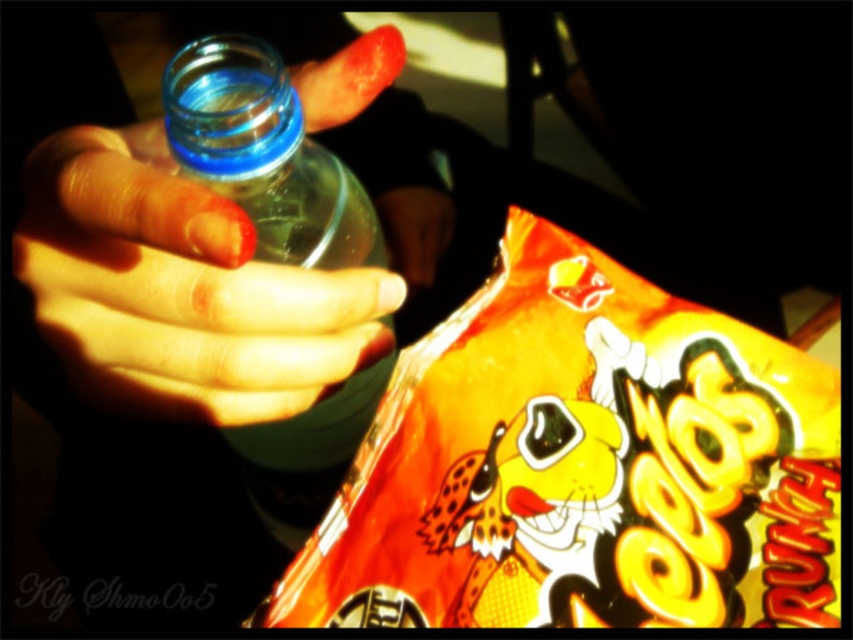
Is point (824, 477) farther from camera compared to point (254, 429)?

No, it is in front of (254, 429).

Does shiny orange snack at lower right have a greater height compared to transparent plastic bottle at left?

Incorrect, shiny orange snack at lower right's height is not larger of transparent plastic bottle at left's.

Measure the distance between point (761, 600) and camera.

Point (761, 600) is 15.52 inches away from camera.

The image size is (853, 640). I want to click on shiny orange snack at lower right, so click(582, 467).

Is point (236, 381) in front of point (279, 112)?

No, (236, 381) is behind (279, 112).

Does point (105, 150) come behind point (289, 122)?

No, (105, 150) is in front of (289, 122).

This screenshot has width=853, height=640. Describe the element at coordinates (178, 289) in the screenshot. I see `translucent plastic hand at center` at that location.

Locate an element on the screen. The width and height of the screenshot is (853, 640). translucent plastic hand at center is located at coordinates (178, 289).

Does shiny orange snack at lower right have a lesser width compared to translucent plastic hand at center?

No.

Is shiny orange snack at lower right below translucent plastic hand at center?

Yes, shiny orange snack at lower right is below translucent plastic hand at center.

Which is behind, point (537, 241) or point (45, 140)?

The point (537, 241) is more distant.

Find the location of a particular element. The width and height of the screenshot is (853, 640). shiny orange snack at lower right is located at coordinates coord(582,467).